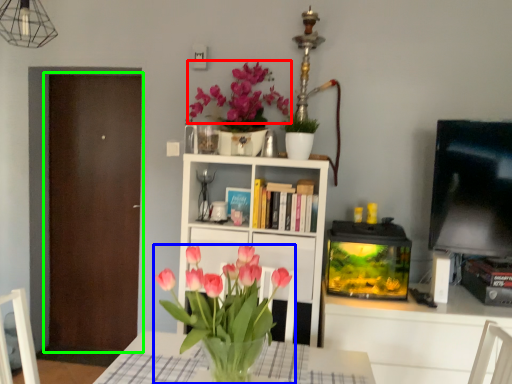
Question: Estimate the real-world distances between objects in this image. Which object is closer to flower (highlighted by a red box), houseplant (highlighted by a blue box) or door (highlighted by a green box)?

Choices:
 (A) houseplant
 (B) door

Answer: (B)